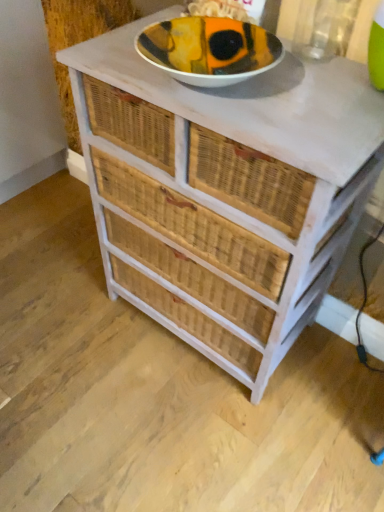
The width and height of the screenshot is (384, 512). I want to click on vacant space in front of white wicker chest of drawers at center, so click(x=194, y=437).